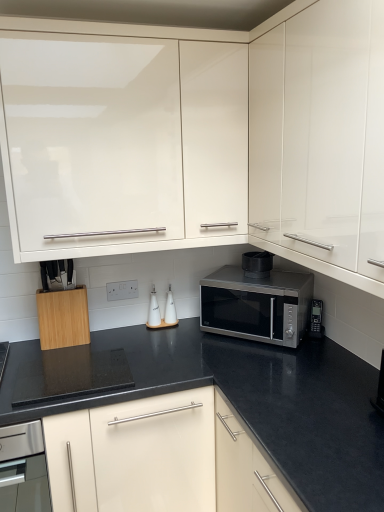
Question: Is black matte microwave at center, the 2th appliance from the right, oriented away from satin silver microwave at center?

Choices:
 (A) no
 (B) yes

Answer: (A)

Question: Does black matte microwave at center, the 3th appliance viewed from the left, have a larger size compared to satin silver microwave at center?

Choices:
 (A) yes
 (B) no

Answer: (B)

Question: Is black matte microwave at center, the 2th appliance from the right, positioned behind satin silver microwave at center?

Choices:
 (A) no
 (B) yes

Answer: (B)

Question: Is black matte microwave at center, the 2th appliance from the right, placed right next to satin silver microwave at center?

Choices:
 (A) yes
 (B) no

Answer: (B)

Question: Is glossy white cabinet at center, marked as the third cabinetry in a left-to-right arrangement, in front of or behind black matte microwave at center, the 2th appliance from the right, in the image?

Choices:
 (A) front
 (B) behind

Answer: (A)

Question: From a real-world perspective, relative to black matte microwave at center, the 2th appliance from the right, is glossy white cabinet at center, the first cabinetry positioned from the right, vertically above or below?

Choices:
 (A) above
 (B) below

Answer: (A)

Question: Is glossy white cabinet at center, marked as the third cabinetry in a left-to-right arrangement, inside the boundaries of black matte microwave at center, the 2th appliance from the right, or outside?

Choices:
 (A) inside
 (B) outside

Answer: (B)

Question: Considering the positions of glossy white cabinet at center, the first cabinetry positioned from the right, and black matte microwave at center, the 2th appliance from the right, in the image, is glossy white cabinet at center, the first cabinetry positioned from the right, bigger or smaller than black matte microwave at center, the 2th appliance from the right,?

Choices:
 (A) big
 (B) small

Answer: (A)

Question: Is white glossy salt shaker at center, the 1th appliance viewed from the left, in front of or behind black matte microwave at center, the 3th appliance viewed from the left, in the image?

Choices:
 (A) behind
 (B) front

Answer: (A)

Question: Is white glossy salt shaker at center, arranged as the 4th appliance when viewed from the right, taller or shorter than black matte microwave at center, the 3th appliance viewed from the left?

Choices:
 (A) short
 (B) tall

Answer: (B)

Question: From a real-world perspective, is white glossy salt shaker at center, arranged as the 4th appliance when viewed from the right, physically located above or below black matte microwave at center, the 3th appliance viewed from the left?

Choices:
 (A) below
 (B) above

Answer: (A)

Question: Is point (155, 290) closer or farther from the camera than point (258, 260)?

Choices:
 (A) farther
 (B) closer

Answer: (A)

Question: Which is correct: white glossy salt shaker at center, arranged as the 4th appliance when viewed from the right, is inside white ceramic oil bottles at center, the 2th appliance from the left, or outside of it?

Choices:
 (A) outside
 (B) inside

Answer: (A)

Question: Looking at the image, does white glossy salt shaker at center, arranged as the 4th appliance when viewed from the right, seem bigger or smaller compared to white ceramic oil bottles at center, the third appliance positioned from the right?

Choices:
 (A) big
 (B) small

Answer: (B)